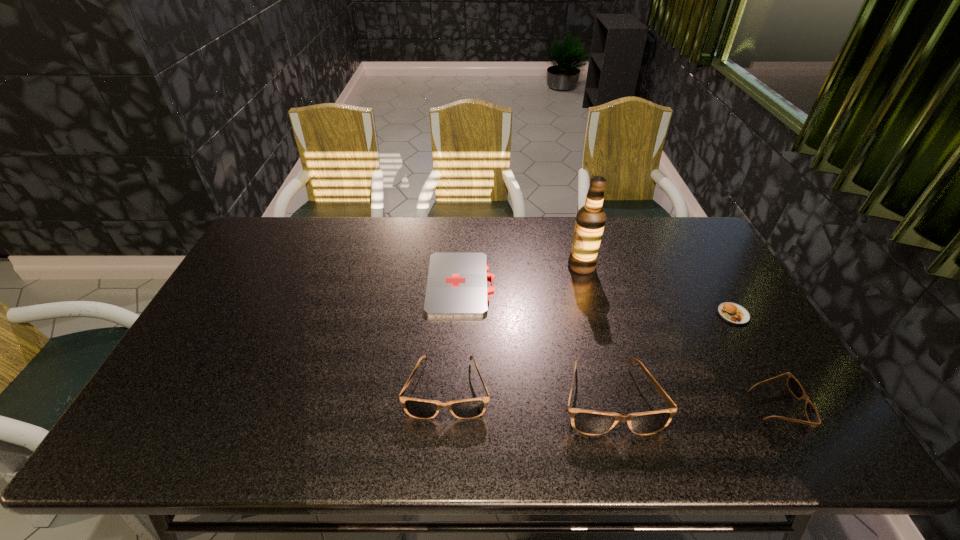
This screenshot has height=540, width=960. I want to click on vacant space at the near left corner, so coord(191,402).

Find the location of a particular element. vacant point at the far right corner is located at coordinates click(x=660, y=232).

Locate an element on the screen. The width and height of the screenshot is (960, 540). empty location between the patty and the shortest sunglasses is located at coordinates (756, 361).

Image resolution: width=960 pixels, height=540 pixels. Identify the location of vacant space that is in between the second tallest sunglasses and the shortest sunglasses. pos(612,398).

Where is `free point between the leftmost sunglasses and the alcohol`? Image resolution: width=960 pixels, height=540 pixels. free point between the leftmost sunglasses and the alcohol is located at coordinates (515, 327).

Where is `vacant space in between the first-aid kit and the tallest object`? This screenshot has height=540, width=960. vacant space in between the first-aid kit and the tallest object is located at coordinates [521, 275].

Find the location of a particular element. This screenshot has height=540, width=960. free space between the fourth shortest object and the second sunglasses from right to left is located at coordinates (528, 393).

Where is `empty space between the tallest object and the patty`? The width and height of the screenshot is (960, 540). empty space between the tallest object and the patty is located at coordinates (658, 291).

You are a GUI agent. You are given a task and a screenshot of the screen. Output one action in this format:
    pyautogui.click(x=<x>, y=<y>)
    Task: Click on the empty location between the alcohol and the patty
    This screenshot has height=540, width=960.
    Given the screenshot: What is the action you would take?
    pos(658,291)

This screenshot has width=960, height=540. Identify the location of free spot between the second sunglasses from right to left and the patty. click(x=671, y=356).